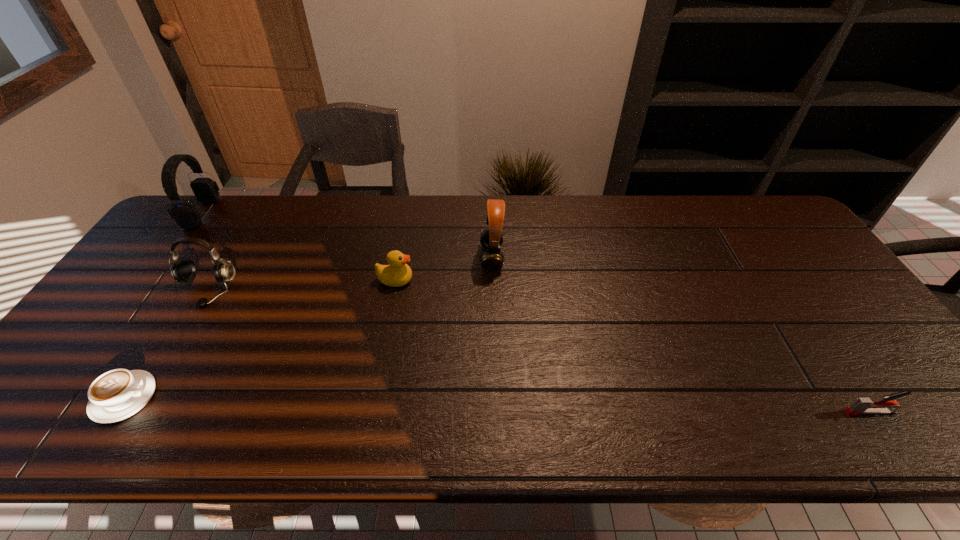
This screenshot has height=540, width=960. Find the location of `vacant space at the near edge of the desktop`. vacant space at the near edge of the desktop is located at coordinates (633, 433).

In the image, there is a desktop. At what (x,y) coordinates should I click in order to perform the action: click on free space at the left edge. Please return your answer as a coordinate pair (x, y). The image size is (960, 540). Looking at the image, I should click on (118, 359).

Image resolution: width=960 pixels, height=540 pixels. I want to click on blank space at the right edge of the desktop, so pos(851,393).

Locate an element on the screen. The height and width of the screenshot is (540, 960). free space at the near right corner of the desktop is located at coordinates (926, 415).

Identify the location of free space that is in between the second object from right to left and the third shortest object. Image resolution: width=960 pixels, height=540 pixels. (444, 269).

Where is `free point between the cappuccino and the stapler`? free point between the cappuccino and the stapler is located at coordinates (497, 404).

The width and height of the screenshot is (960, 540). I want to click on free space that is in between the duck and the stapler, so click(x=633, y=346).

Find the location of a particular element. vacant space that is in between the shortest object and the third shortest object is located at coordinates (259, 339).

Identify the location of vacant area that lies between the leftmost headset and the rightmost headset. (347, 235).

This screenshot has height=540, width=960. Find the location of `vacant region between the third shortest object and the shortest headset`. vacant region between the third shortest object and the shortest headset is located at coordinates (301, 286).